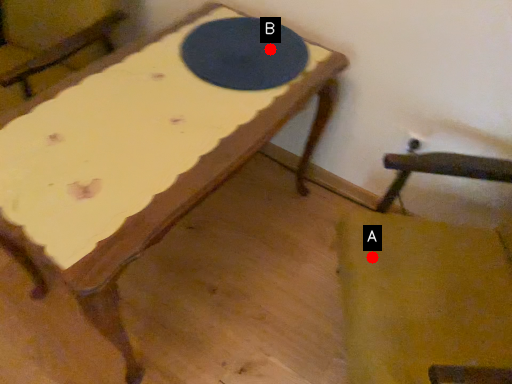
Question: Two points are circled on the image, labeled by A and B beside each circle. Which point is closer to the camera taking this photo?

Choices:
 (A) A is closer
 (B) B is closer

Answer: (A)